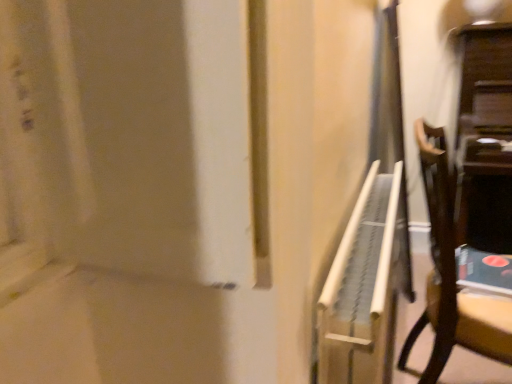
What do you see at coordinates (452, 278) in the screenshot?
I see `dark wood chair at right` at bounding box center [452, 278].

In order to face dark wood chair at right, should I rotate leftwards or rightwards?

To align with it, rotate right about 27.483°.

Identify the location of dark wood chair at right. The width and height of the screenshot is (512, 384). (452, 278).

Where is `dark wood chair at right`? Image resolution: width=512 pixels, height=384 pixels. dark wood chair at right is located at coordinates (452, 278).